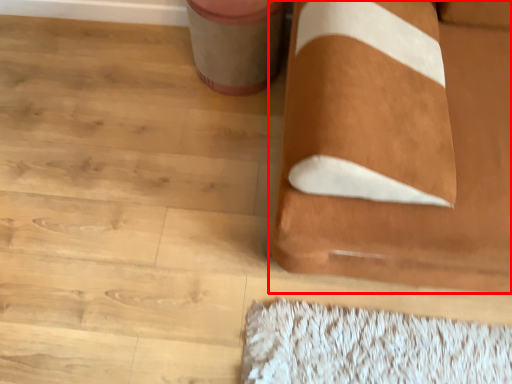
Question: From the image's perspective, what is the correct spatial relationship of furniture (annotated by the red box) in relation to potty?

Choices:
 (A) below
 (B) above

Answer: (A)